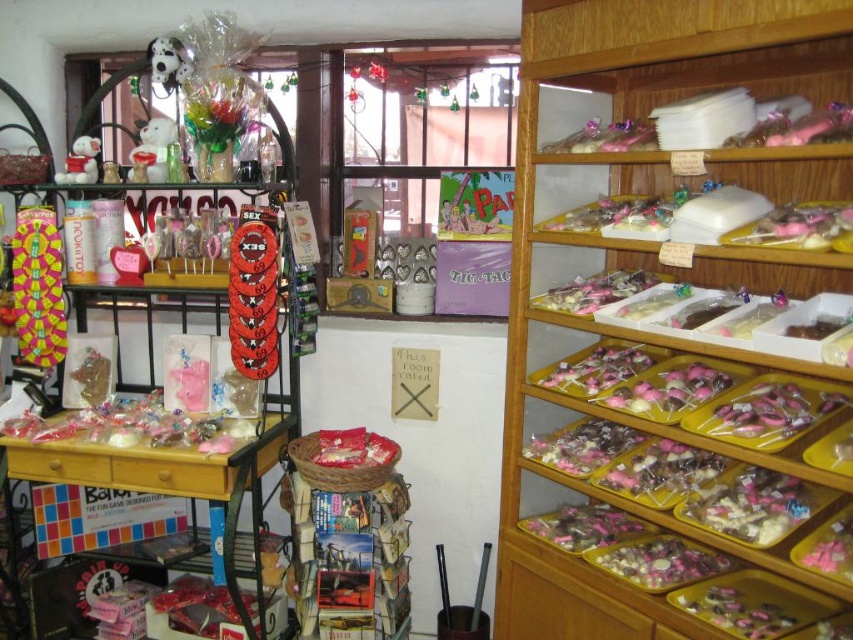
Question: Which of the following is the farthest from the observer?

Choices:
 (A) white plush bear at left
 (B) white plush bear at upper left
 (C) red glossy disc at center
 (D) wooden shelves at right

Answer: (A)

Question: Can you confirm if wooden shelves at right is positioned above white plush bear at left?

Choices:
 (A) no
 (B) yes

Answer: (A)

Question: Which of the following is the farthest from the observer?

Choices:
 (A) (74, 168)
 (B) (178, 52)

Answer: (A)

Question: Is white plush bear at upper left closer to the viewer compared to white plush bear at left?

Choices:
 (A) yes
 (B) no

Answer: (A)

Question: Which point is farther to the camera?

Choices:
 (A) matte black soccer ball at upper left
 (B) white plush bear at upper left
 (C) wooden shelves at right
 (D) white plush bear at left

Answer: (D)

Question: Is white plush bear at upper left thinner than white plush bear at left?

Choices:
 (A) yes
 (B) no

Answer: (A)